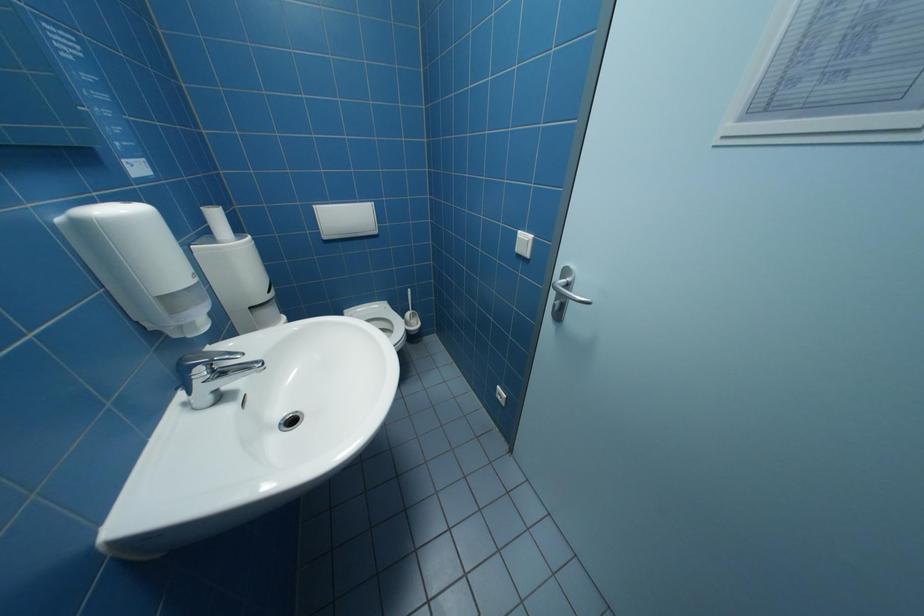
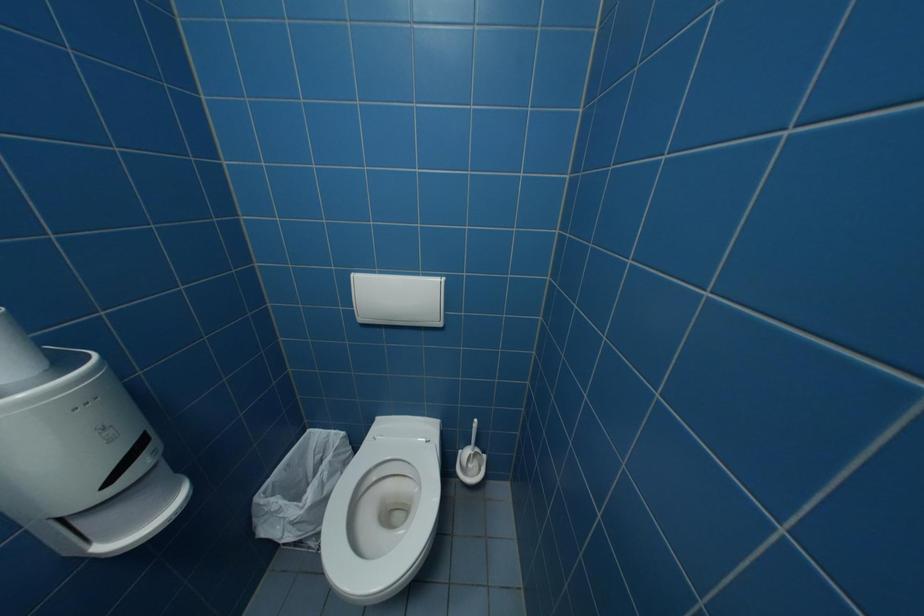
Question: The first image is from the beginning of the video and the second image is from the end. How did the camera likely rotate when shooting the video?

Choices:
 (A) Left
 (B) Right
 (C) Up
 (D) Down

Answer: (A)